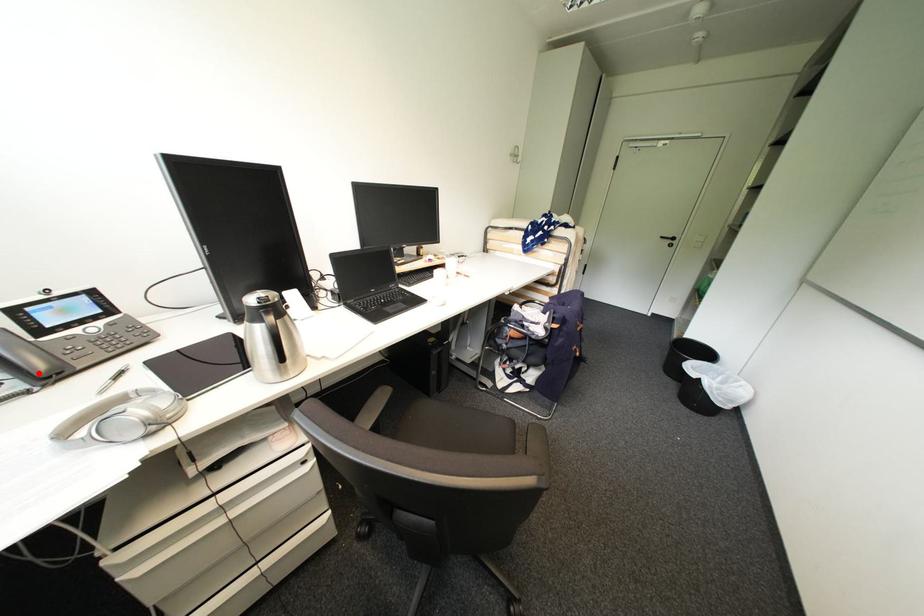
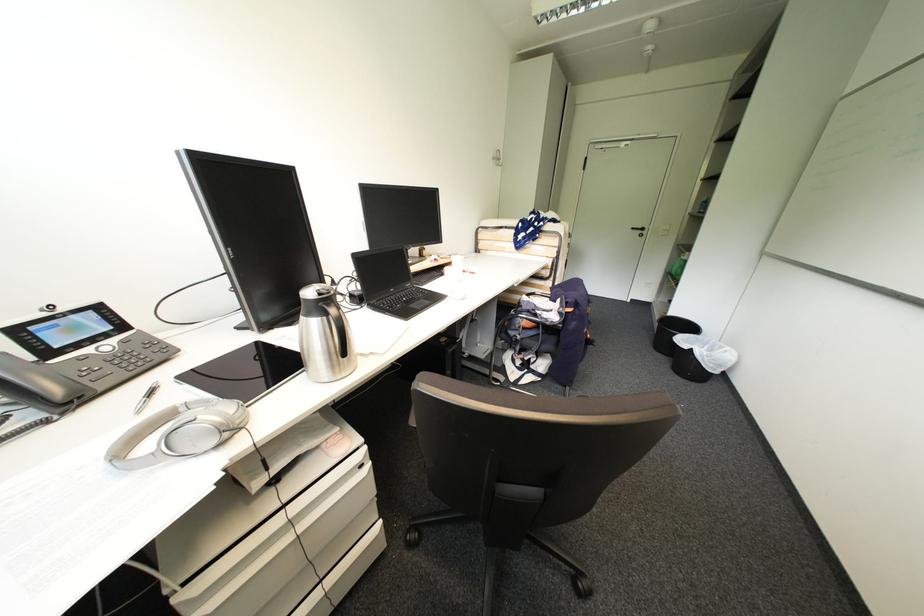
Find the pixel in the second image that matches the highlighted location in the first image.

(56, 399)